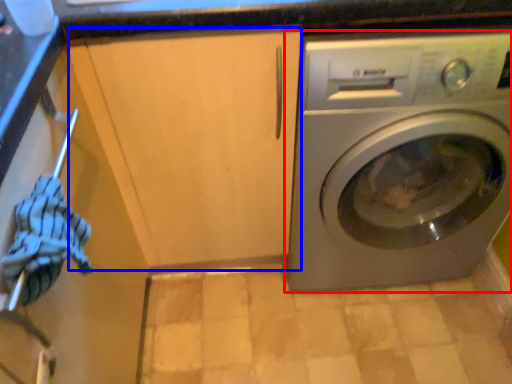
Question: Which of the following is the farthest to the observer, washing machine (highlighted by a red box) or cabinetry (highlighted by a blue box)?

Choices:
 (A) washing machine
 (B) cabinetry

Answer: (A)